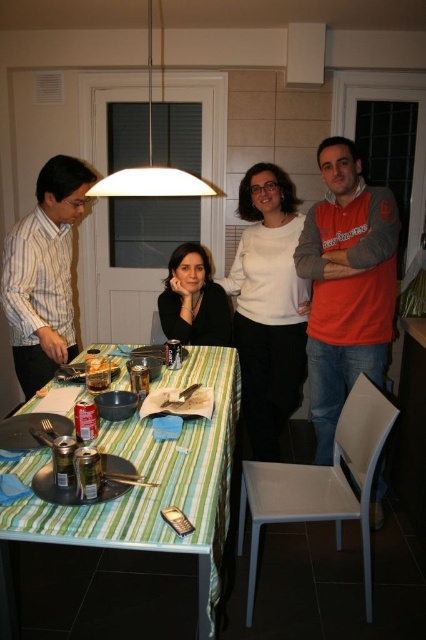
You are a guest at this gathering and need to retrieve your orange fleece jacket at right. You are currently standing near the green striped tablecloth at center. Which direction should you move to reach your jacket?

The orange fleece jacket at right is further away from the viewer compared to the green striped tablecloth at center. To reach your jacket, you should move backward away from the table toward the right side where the jacket is located.